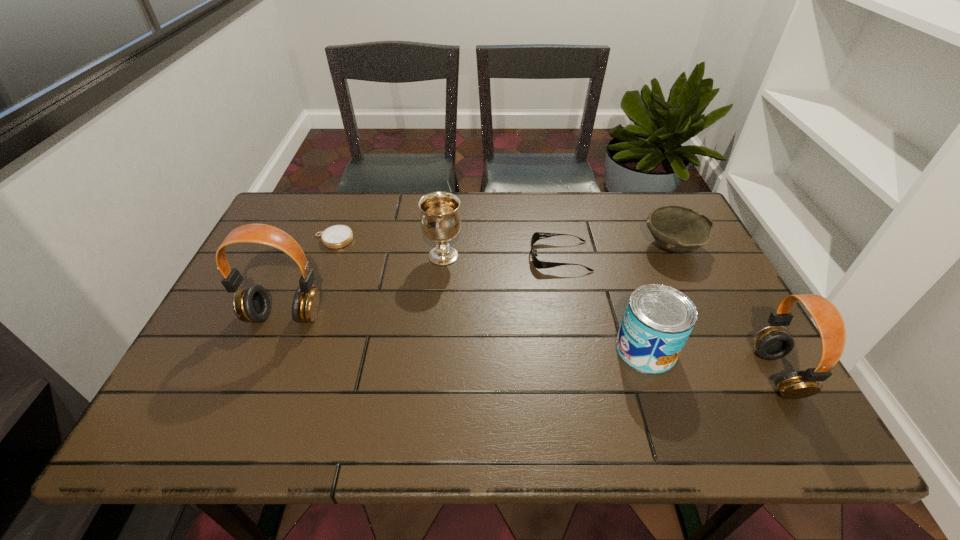
Locate an element on the screen. Image resolution: width=960 pixels, height=540 pixels. object that is positioned at the near right corner is located at coordinates (771, 343).

The width and height of the screenshot is (960, 540). I want to click on vacant region at the far edge of the desktop, so click(x=637, y=232).

Locate an element on the screen. vacant space at the near edge of the desktop is located at coordinates (478, 364).

Find the location of a particular element. This screenshot has height=540, width=960. blank space at the right edge of the desktop is located at coordinates (715, 284).

I want to click on vacant space that's between the right headset and the third shortest object, so click(x=725, y=309).

The height and width of the screenshot is (540, 960). What are the coordinates of `free space between the tallest object and the right headset` in the screenshot? It's located at (531, 345).

Where is `free space that is in between the shortest object and the fourth shortest object`? free space that is in between the shortest object and the fourth shortest object is located at coordinates point(490,294).

The image size is (960, 540). Identify the location of vacant space that's between the fifth shortest object and the shortest object. (389, 248).

Locate an element on the screen. unoccupied position between the bowl and the shortest object is located at coordinates (503, 242).

I want to click on free point between the left headset and the nearer headset, so click(x=531, y=345).